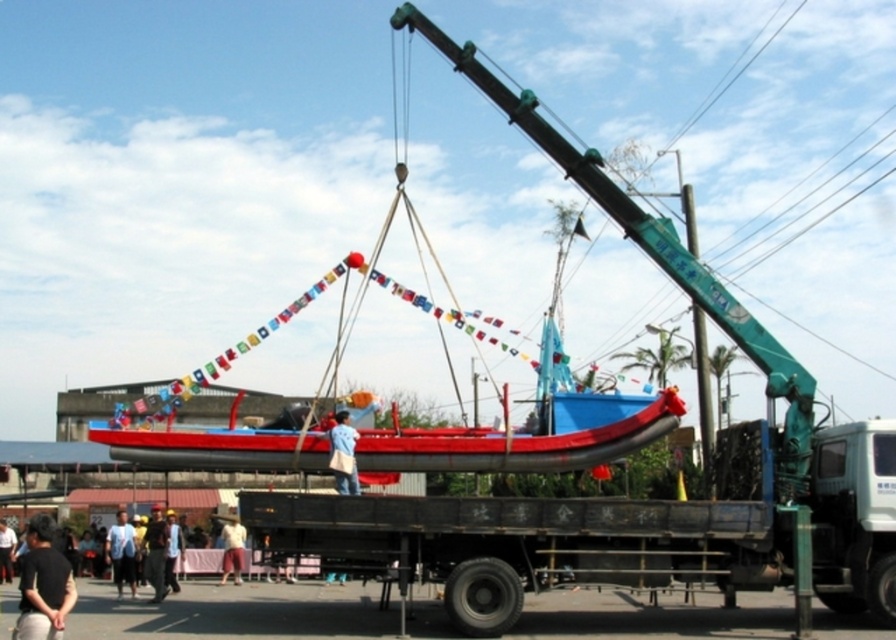
Question: Among these points, which one is farthest from the camera?

Choices:
 (A) click(339, 474)
 (B) click(128, 451)
 (C) click(171, 534)
 (D) click(16, 540)

Answer: (D)

Question: Among these objects, which one is nearest to the camera?

Choices:
 (A) light blue shirt at center
 (B) white cotton shirt at lower center

Answer: (A)

Question: From the image, what is the correct spatial relationship of blue fabric bag at center in relation to brown fabric shirt at center?

Choices:
 (A) below
 (B) above

Answer: (B)

Question: Which object is positioned farthest from the white cotton shirt at lower center?

Choices:
 (A) blue fabric bag at center
 (B) dark blue shirt at lower left
 (C) metallic trailer truck at center
 (D) black matte shirt at lower left

Answer: (C)

Question: Does red rubber boat at center appear on the left side of white cotton shirt at lower center?

Choices:
 (A) no
 (B) yes

Answer: (A)

Question: Does brown fabric shirt at center appear on the left side of light blue shirt at center?

Choices:
 (A) yes
 (B) no

Answer: (A)